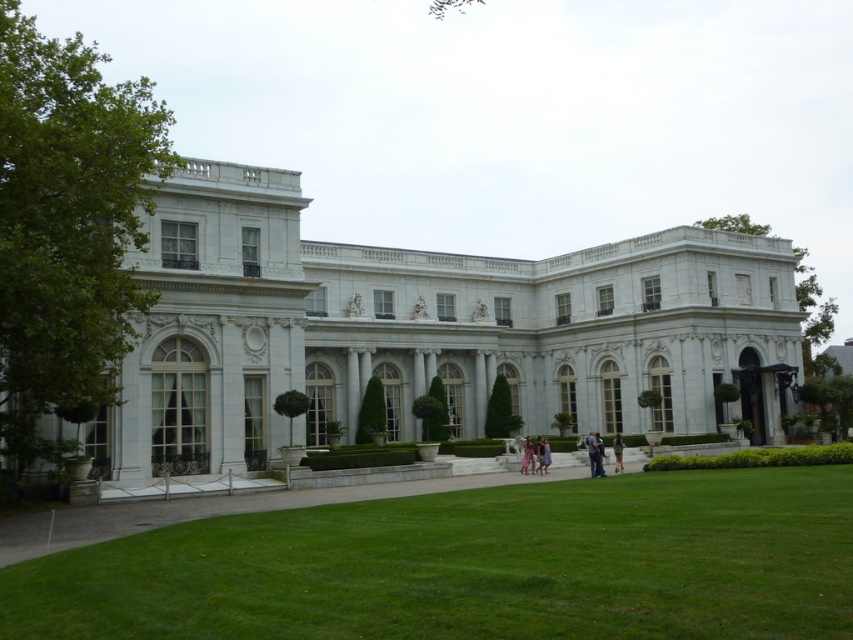
In the scene shown: Who is shorter, white marble mansion at center or green grass at center?

Standing shorter between the two is green grass at center.

Is white marble mansion at center in front of green grass at center?

No, white marble mansion at center is further to the viewer.

What do you see at coordinates (424, 332) in the screenshot? I see `white marble mansion at center` at bounding box center [424, 332].

Find the location of a particular element. This screenshot has width=853, height=640. white marble mansion at center is located at coordinates (424, 332).